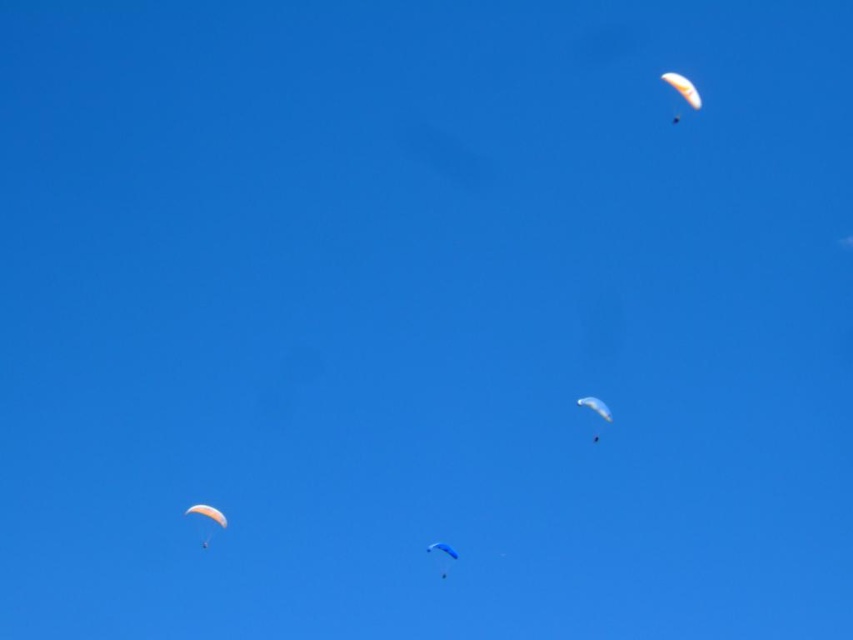
You are a photographer standing on the ground looking up at the sky. You want to capture the orange translucent parasail at upper right in your photo. According to the coordinates provided, where should you aim your camera? Please provide the coordinates in the format of a point like point (683, 88).

The orange translucent parasail at upper right is located at point (683, 88), so you should aim your camera at that coordinate to capture it.

Based on the photo, you are a pilot in a white matte parachute at lower left and want to catch up with the white matte parachute at center. Given that you can move at 10 feet per second, how many seconds will it take to reach them?

Answer: The white matte parachute at lower left is 120.06 feet away from the white matte parachute at center. At a speed of 10 feet per second, it would take 12.006 seconds to reach them.